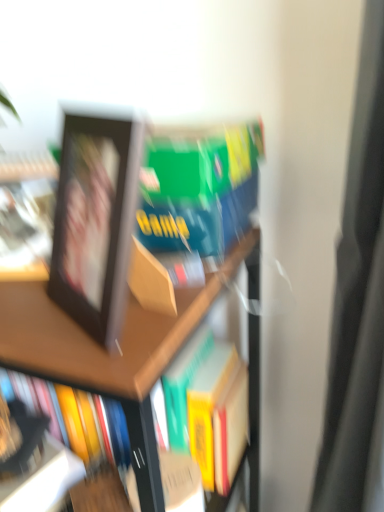
Question: Looking at their shapes, would you say black matte picture frame at upper left is wider or thinner than wooden bookshelf at upper left?

Choices:
 (A) wide
 (B) thin

Answer: (B)

Question: From their relative heights in the image, would you say black matte picture frame at upper left is taller or shorter than wooden bookshelf at upper left?

Choices:
 (A) tall
 (B) short

Answer: (B)

Question: Which object is positioned farthest from the black matte picture frame at upper left?

Choices:
 (A) wooden bookshelf at upper left
 (B) matte black photo frame at left

Answer: (A)

Question: Which is farther from the black matte picture frame at upper left?

Choices:
 (A) wooden bookshelf at upper left
 (B) matte black photo frame at left

Answer: (A)